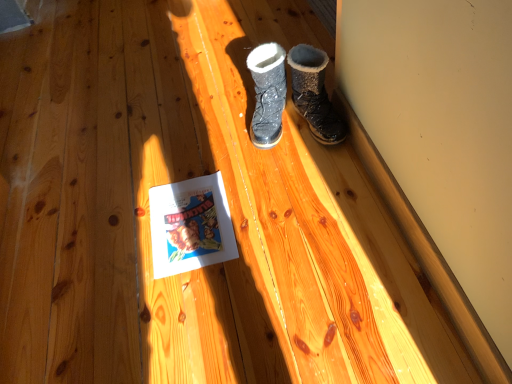
At what (x,y) coordinates should I click in order to perform the action: click on vacant area that is in front of sparkly black boot at center, the first footwear from the left. Please return your answer as a coordinate pair (x, y). Looking at the image, I should click on (273, 165).